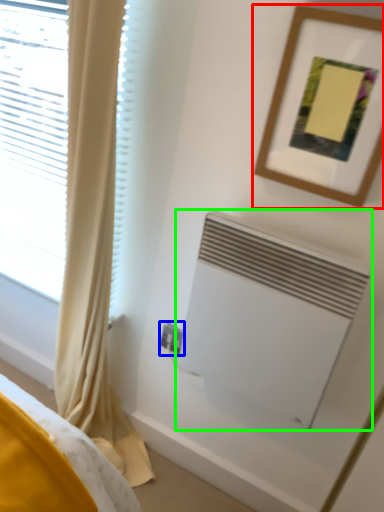
Question: Considering the real-world distances, which object is farthest from picture frame (highlighted by a red box)? electric outlet (highlighted by a blue box) or air conditioning (highlighted by a green box)?

Choices:
 (A) electric outlet
 (B) air conditioning

Answer: (A)